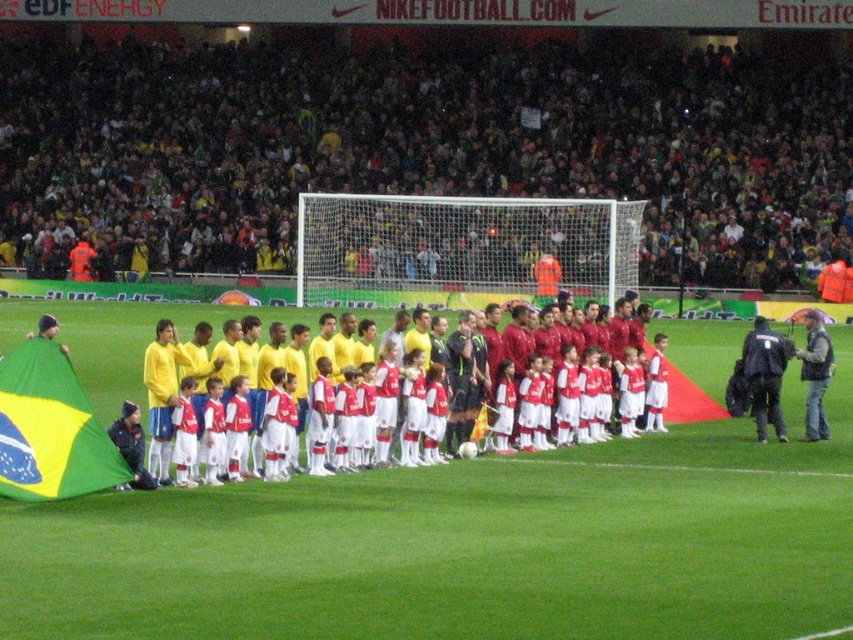
Does yellow-green fabric flag at left appear over matte red soccer uniforms at center?

Actually, yellow-green fabric flag at left is below matte red soccer uniforms at center.

Does yellow-green fabric flag at left lie in front of matte red soccer uniforms at center?

Yes, yellow-green fabric flag at left is closer to the viewer.

Who is more forward, (0,484) or (229,326)?

Point (0,484) is more forward.

The height and width of the screenshot is (640, 853). Identify the location of yellow-green fabric flag at left. (50, 429).

Is the position of green grass football field at center less distant than that of yellow-green fabric flag at left?

That is True.

The image size is (853, 640). Describe the element at coordinates (466, 545) in the screenshot. I see `green grass football field at center` at that location.

Does point (775, 634) come closer to viewer compared to point (0, 387)?

Yes, point (775, 634) is in front of point (0, 387).

In order to click on green grass football field at center in this screenshot , I will do `click(466, 545)`.

Can you confirm if green grass football field at center is positioned above matte red soccer uniforms at center?

No.

Locate an element on the screen. This screenshot has width=853, height=640. green grass football field at center is located at coordinates (466, 545).